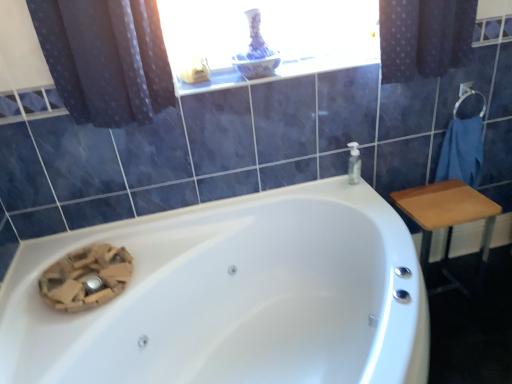
Where is `free space above white glossy window sill at upper center (from a real-world perspective)`? free space above white glossy window sill at upper center (from a real-world perspective) is located at coordinates (278, 64).